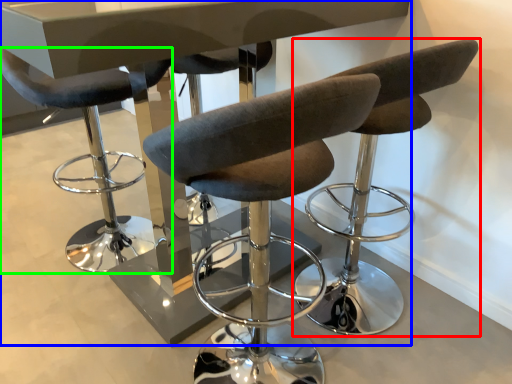
Question: Based on their relative distances, which object is nearer to chair (highlighted by a red box)? Choose from table (highlighted by a blue box) and chair (highlighted by a green box).

Choices:
 (A) table
 (B) chair

Answer: (A)